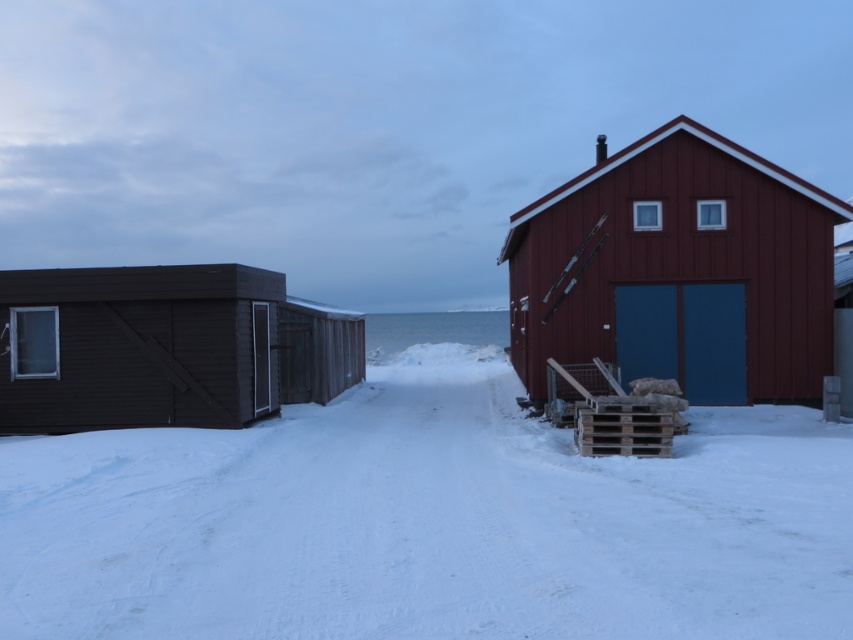
You are standing at the origin point in the snowy landscape. The matte red barn at right is represented by point (677, 272). Can you determine the direction of the matte red barn at right relative to your position?

The matte red barn at right is located at coordinates (677, 272), which places it to the right and slightly above your position at the origin. Therefore, the direction is northeast.

You are standing in the snowy landscape and want to walk to the dark brown wood cabin at left. Which direction should you head to avoid the white powdery snow at center?

You should head to the left side of the dark brown wood cabin at left to avoid the white powdery snow at center, as the snow is located below the cabin.